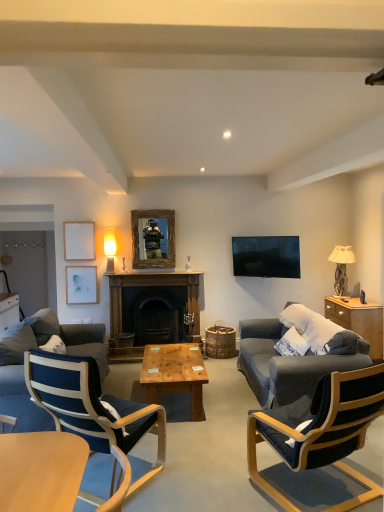
The width and height of the screenshot is (384, 512). Find the location of `vacant space in dark blue fabric chair at right, the 2th chair positioned from the left (from a real-world perspective)`. vacant space in dark blue fabric chair at right, the 2th chair positioned from the left (from a real-world perspective) is located at coordinates (318, 489).